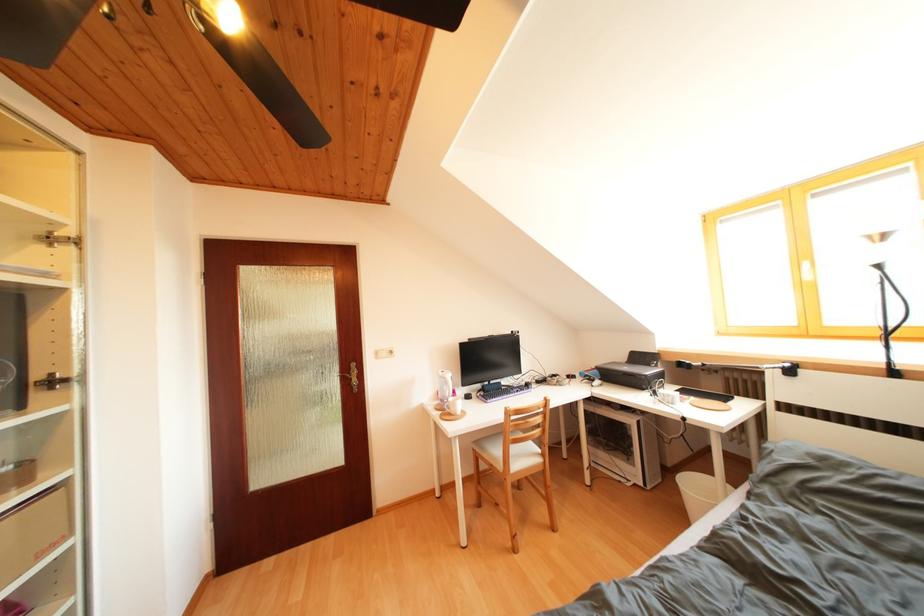
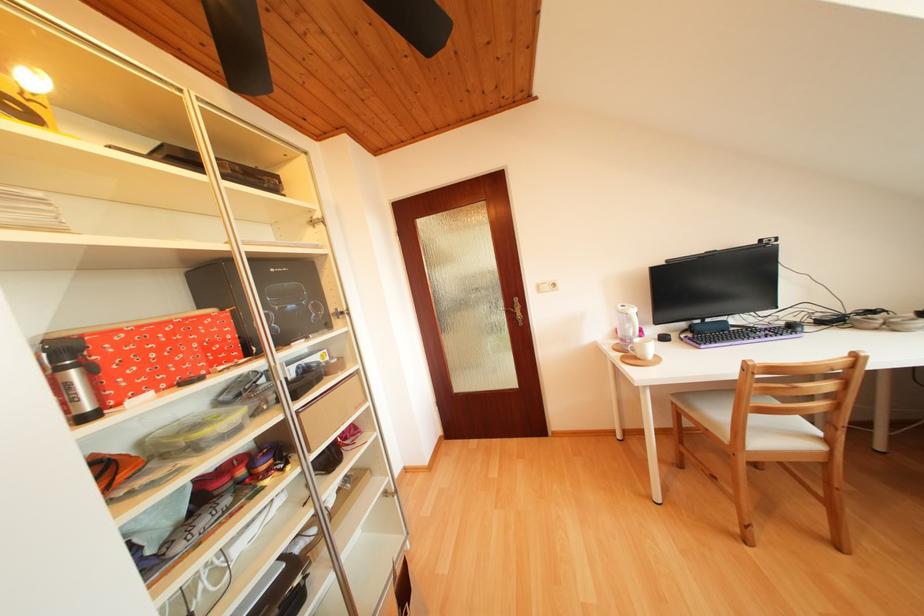
In the second image, find the point that corresponds to point (345, 374) in the first image.

(509, 309)